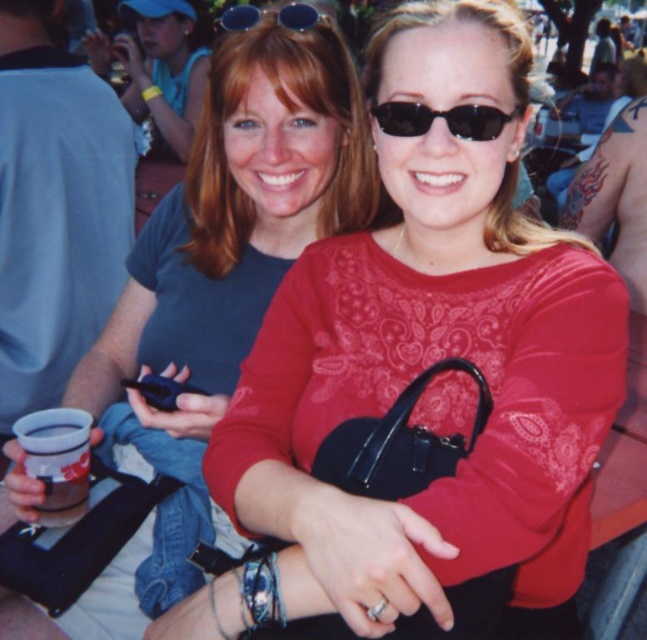
Question: Can you confirm if matte black purse at center is positioned below black plastic sunglasses at center?

Choices:
 (A) yes
 (B) no

Answer: (A)

Question: Is matte black purse at center further to the viewer compared to black plastic sunglasses at center?

Choices:
 (A) no
 (B) yes

Answer: (B)

Question: Among these points, which one is nearest to the camera?

Choices:
 (A) (298, 3)
 (B) (375, 115)
 (C) (162, 330)

Answer: (B)

Question: Does black plastic sunglasses at center come in front of sunglasses at upper center?

Choices:
 (A) no
 (B) yes

Answer: (B)

Question: Which of these objects is positioned farthest from the black plastic sunglasses at center?

Choices:
 (A) matte black purse at center
 (B) sunglasses at upper center

Answer: (A)

Question: Among these objects, which one is nearest to the camera?

Choices:
 (A) black plastic sunglasses at center
 (B) sunglasses at upper center
 (C) matte black purse at center

Answer: (A)